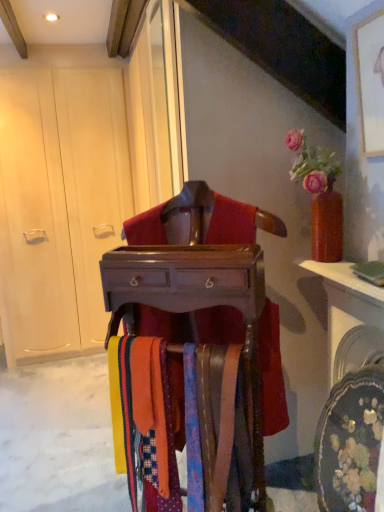
Question: From the image's perspective, relative to matte white armoire at left, is wooden chest at center above or below?

Choices:
 (A) below
 (B) above

Answer: (A)

Question: Is wooden chest at center in front of or behind matte white armoire at left in the image?

Choices:
 (A) front
 (B) behind

Answer: (A)

Question: Is wooden chest at center bigger or smaller than matte white armoire at left?

Choices:
 (A) big
 (B) small

Answer: (B)

Question: From the image's perspective, is matte white armoire at left positioned above or below wooden chest at center?

Choices:
 (A) below
 (B) above

Answer: (B)

Question: Is matte white armoire at left in front of or behind wooden chest at center in the image?

Choices:
 (A) front
 (B) behind

Answer: (B)

Question: From their relative heights in the image, would you say matte white armoire at left is taller or shorter than wooden chest at center?

Choices:
 (A) short
 (B) tall

Answer: (B)

Question: Is matte white armoire at left bigger or smaller than wooden chest at center?

Choices:
 (A) small
 (B) big

Answer: (B)